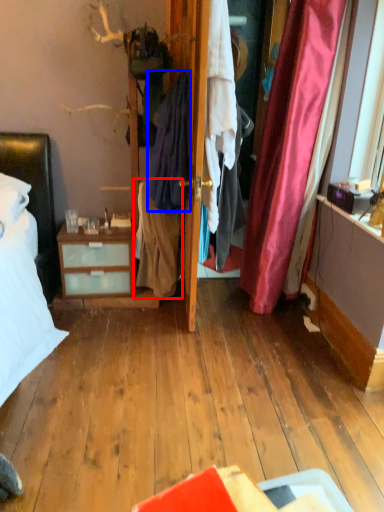
Question: Which of the following is the farthest to the observer, clothing (highlighted by a red box) or clothing (highlighted by a blue box)?

Choices:
 (A) clothing
 (B) clothing

Answer: (A)